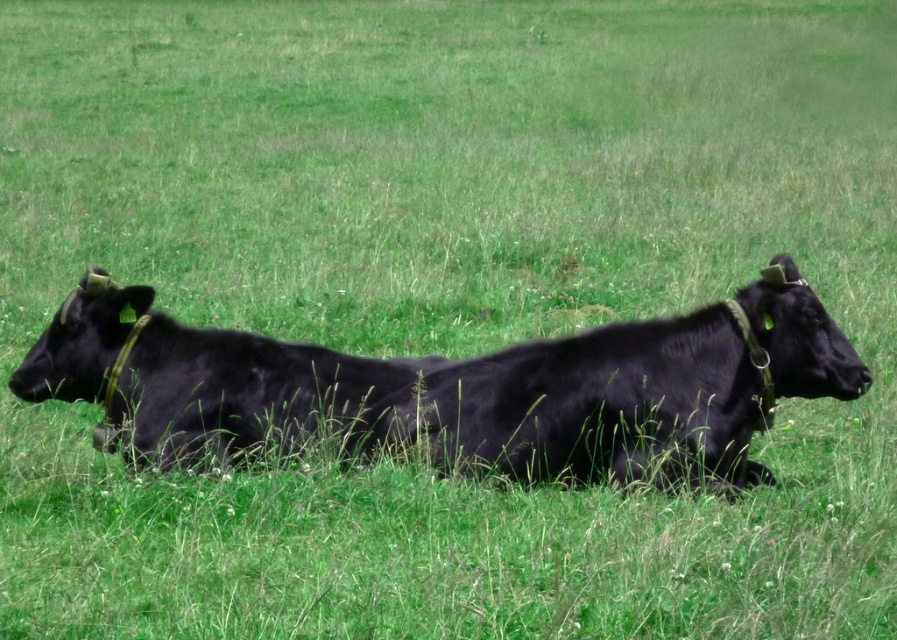
Question: Observing the image, what is the correct spatial positioning of black smooth cow at center in reference to shiny black cow at left?

Choices:
 (A) right
 (B) left

Answer: (A)

Question: Can you confirm if black smooth cow at center is positioned to the right of shiny black cow at left?

Choices:
 (A) yes
 (B) no

Answer: (A)

Question: Among these points, which one is farthest from the camera?

Choices:
 (A) (473, 364)
 (B) (307, 372)

Answer: (B)

Question: Can you confirm if black smooth cow at center is positioned above shiny black cow at left?

Choices:
 (A) yes
 (B) no

Answer: (A)